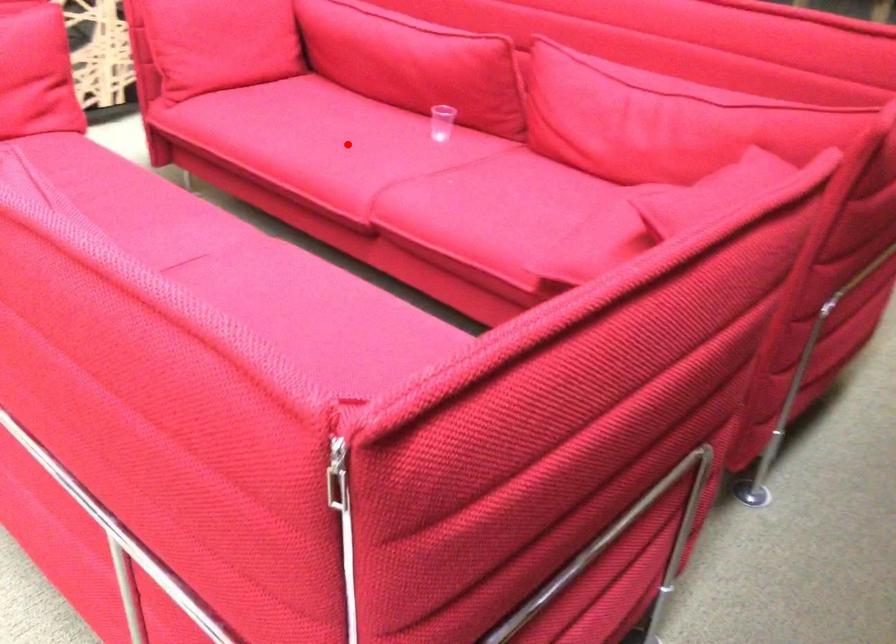
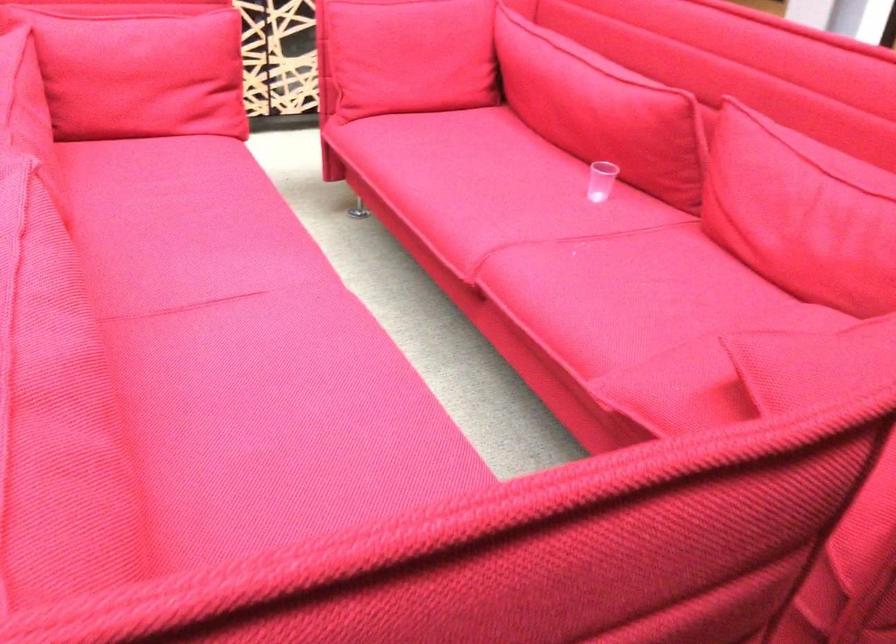
Where in the second image is the point corresponding to the highlighted location from the first image?

(488, 192)